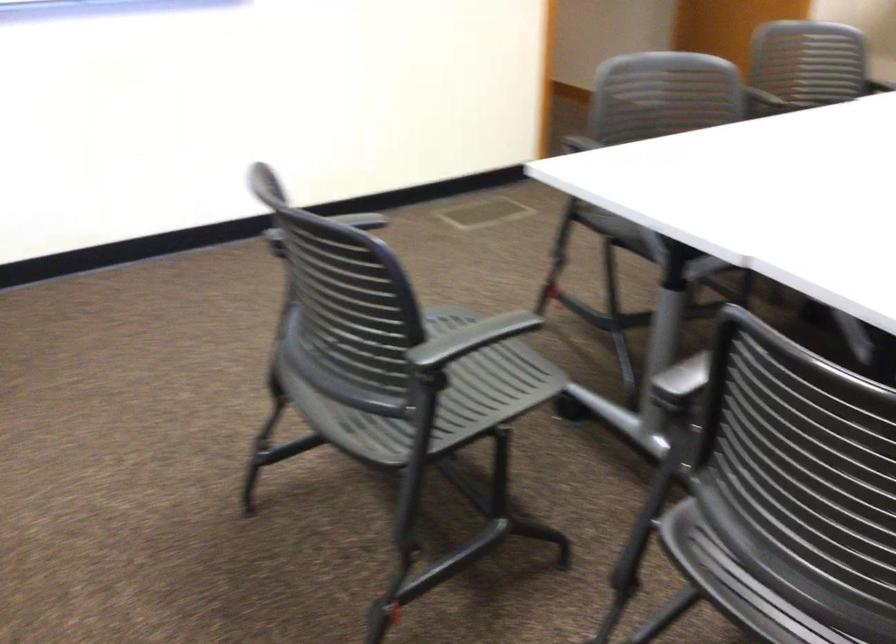
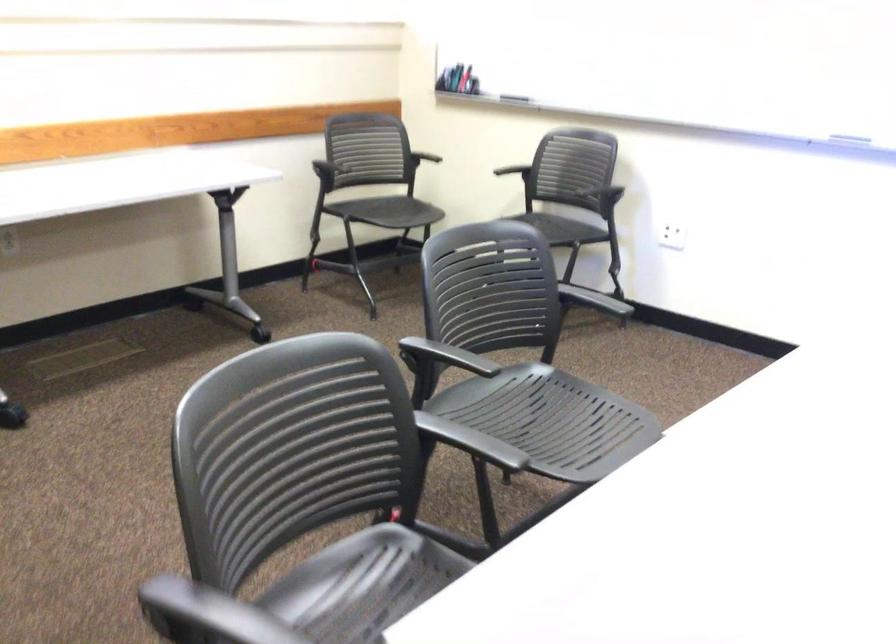
Find the pixel in the second image that matches point 694,540 in the first image.

(362, 585)